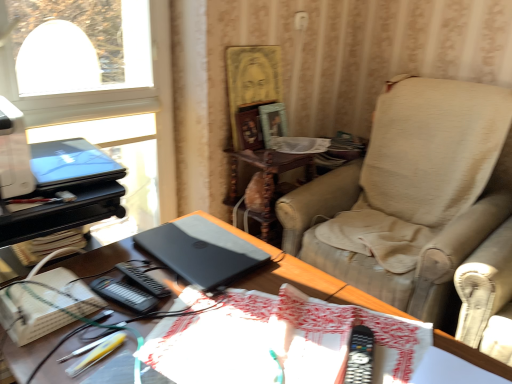
Identify the location of free point to the right of white cardboard book at lower left. The height and width of the screenshot is (384, 512). (117, 321).